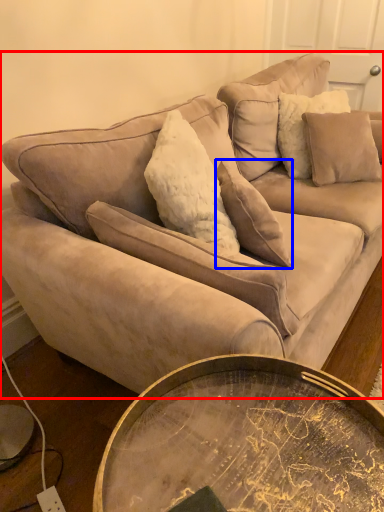
Question: Which of the following is the farthest to the observer, studio couch (highlighted by a red box) or pillow (highlighted by a blue box)?

Choices:
 (A) studio couch
 (B) pillow

Answer: (B)